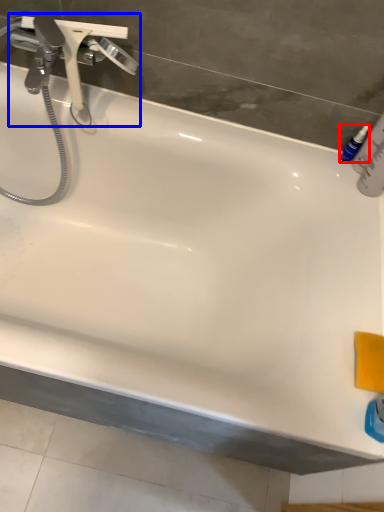
Question: Among these objects, which one is nearest to the camera, mouthwash (highlighted by a red box) or tap (highlighted by a blue box)?

Choices:
 (A) mouthwash
 (B) tap

Answer: (B)